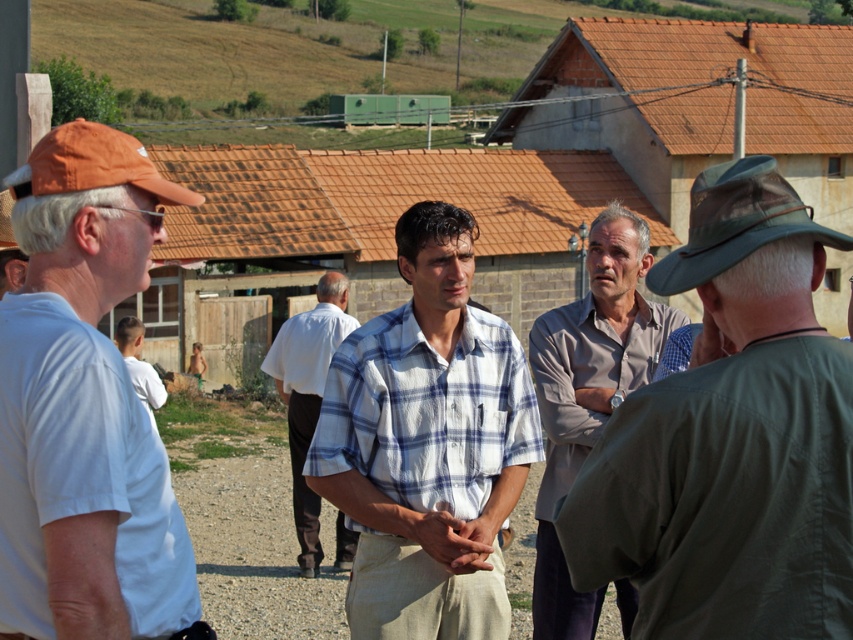
Based on the coordinates provided, which object is positioned at point (84, 404)?

The white cotton shirt at left is positioned at point (84, 404).

Based on the provided scene description, where is the white checkered shirt at center located in terms of coordinates?

The white checkered shirt at center is located at coordinates point [427,444].

Based on the scene description, which object is wider, the plaid shirt at center or the white cotton shirt at left?

The plaid shirt at center is wider than the white cotton shirt at left according to the description.